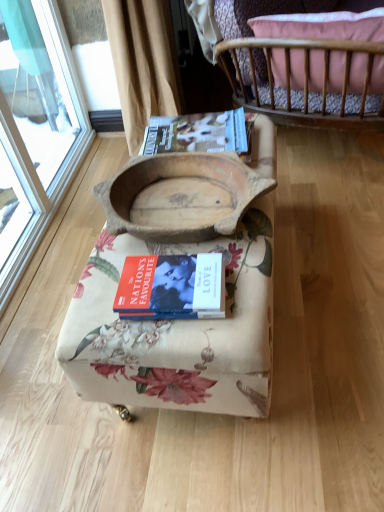
Image resolution: width=384 pixels, height=512 pixels. I want to click on vacant space situated on the left part of hardcover book at center, so click(98, 303).